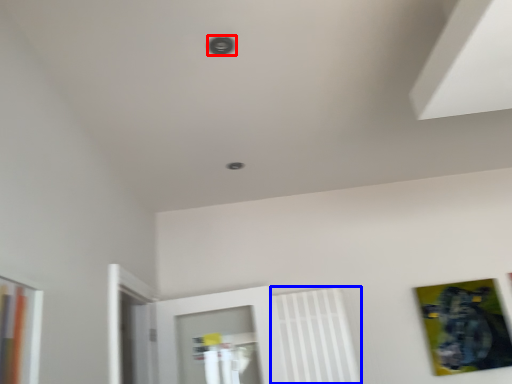
Question: Which of the following is the farthest to the observer, hole (highlighted by a red box) or radiator (highlighted by a blue box)?

Choices:
 (A) hole
 (B) radiator

Answer: (B)